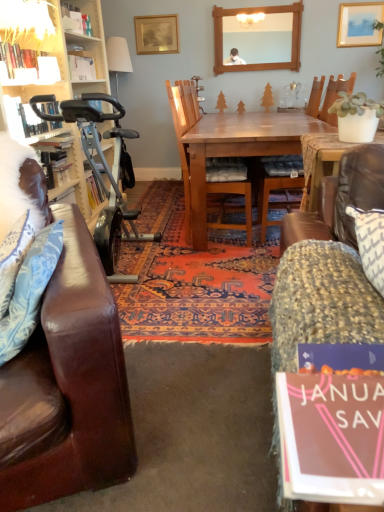
Question: Looking at their shapes, would you say matte white lampshade at upper left is wider or thinner than white feathered pillow at left?

Choices:
 (A) thin
 (B) wide

Answer: (A)

Question: From the image's perspective, is matte white lampshade at upper left located above or below white feathered pillow at left?

Choices:
 (A) below
 (B) above

Answer: (B)

Question: Which is farther from the wooden chair at center, the second chair positioned from the left?

Choices:
 (A) white feathered pillow at left
 (B) wooden table at center
 (C) matte white lampshade at upper left
 (D) matte gold picture frame at upper right, which is the first picture frame in right-to-left order
 (E) fluffy fabric couch at lower right

Answer: (D)

Question: Which object is the farthest from the wooden chair at center, arranged as the 1th chair when viewed from the right?

Choices:
 (A) silver metallic exercise bike at left
 (B) white feathered pillow at left
 (C) blue floral fabric pillow at left
 (D) wooden picture frame at upper center, the first picture frame when ordered from left to right
 (E) wooden frame mirror at upper center

Answer: (D)